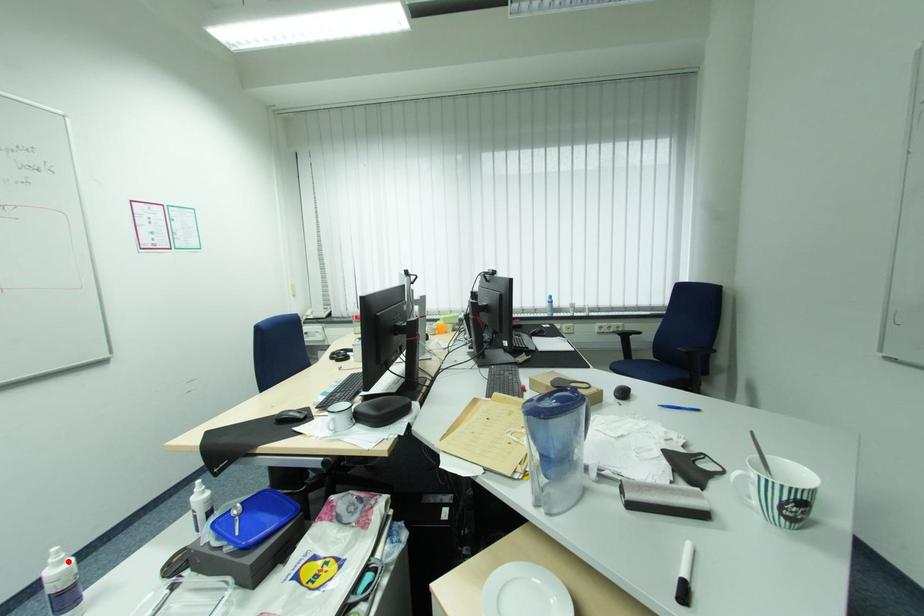
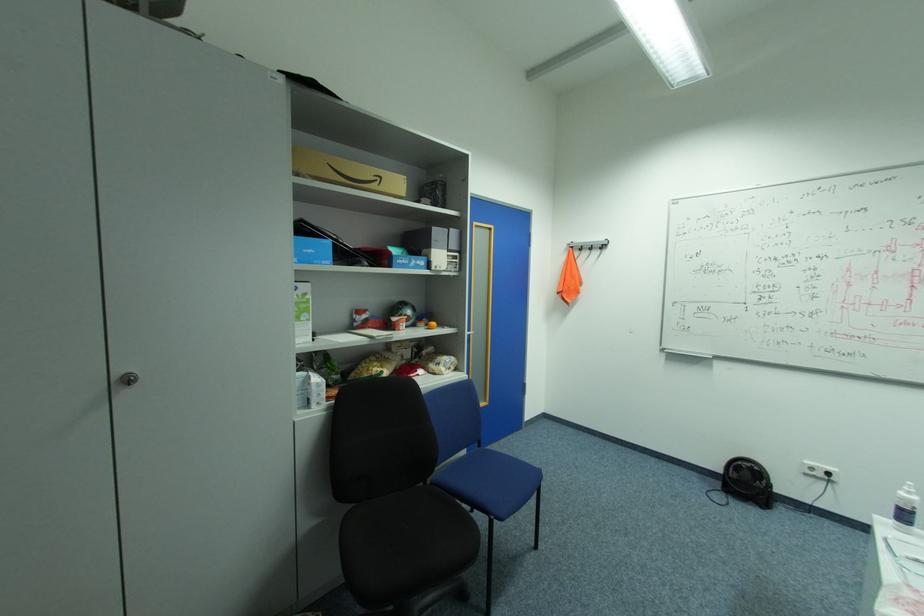
Locate, in the second image, the point that corresponds to the highlighted location in the first image.

(916, 493)